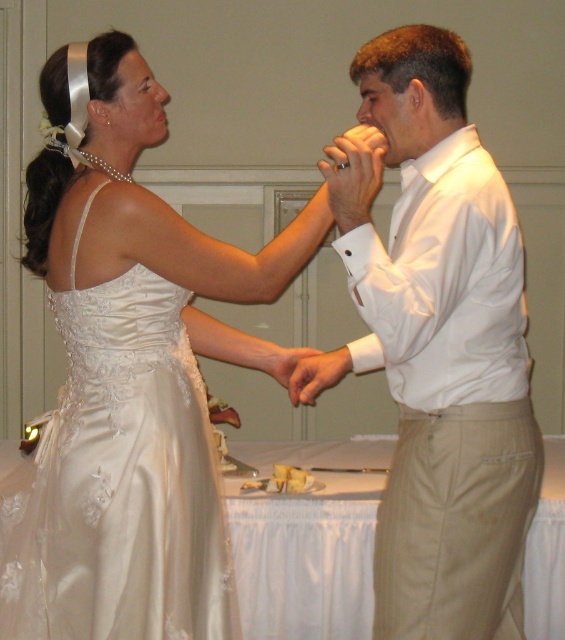
Question: Where is satin dress at center located in relation to white satin shirt at center in the image?

Choices:
 (A) left
 (B) right

Answer: (A)

Question: Which of the following is the closest to the observer?

Choices:
 (A) matte white hand at upper center
 (B) white satin shirt at center

Answer: (B)

Question: Is white satin shirt at center positioned at the back of satin/embroidered dress at left?

Choices:
 (A) yes
 (B) no

Answer: (B)

Question: Does satin dress at center lie behind matte white hand at upper center?

Choices:
 (A) no
 (B) yes

Answer: (A)

Question: Which of the following is the closest to the observer?

Choices:
 (A) matte white hand at upper center
 (B) satin/embroidered dress at left

Answer: (B)

Question: Which of the following is the farthest from the observer?

Choices:
 (A) satin dress at center
 (B) white satin shirt at center

Answer: (A)